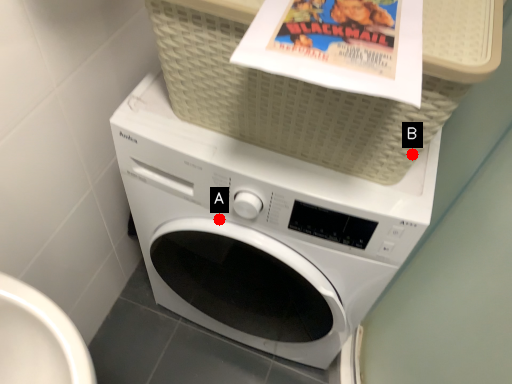
Question: Two points are circled on the image, labeled by A and B beside each circle. Which point appears closest to the camera in this image?

Choices:
 (A) A is closer
 (B) B is closer

Answer: (B)